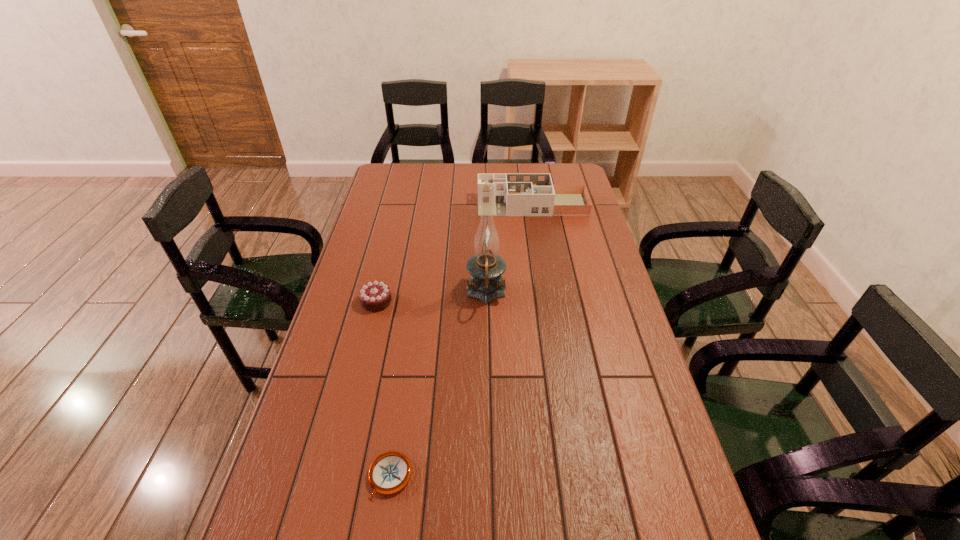
Find the location of `oil lamp`. oil lamp is located at coordinates (486, 267).

This screenshot has width=960, height=540. Identify the location of dollhouse. (513, 194).

Identify the location of the farthest object. This screenshot has height=540, width=960. (513, 194).

Image resolution: width=960 pixels, height=540 pixels. I want to click on the leftmost object, so click(374, 296).

Where is `chocolate cake`? Image resolution: width=960 pixels, height=540 pixels. chocolate cake is located at coordinates (374, 296).

You are a GUI agent. You are given a task and a screenshot of the screen. Output one action in this format:
    pyautogui.click(x=<x>, y=<y>)
    Task: Click on the third object from right to left
    
    Given the screenshot: What is the action you would take?
    pyautogui.click(x=390, y=472)

The image size is (960, 540). I want to click on compass, so click(390, 472).

Where is `free space located on the front of the oil lamp`? free space located on the front of the oil lamp is located at coordinates (488, 414).

This screenshot has width=960, height=540. I want to click on vacant area situated at the front door of the second tallest object, so click(437, 205).

The height and width of the screenshot is (540, 960). What are the coordinates of `vacant point located 0.310m at the front door of the second tallest object` in the screenshot? It's located at (403, 205).